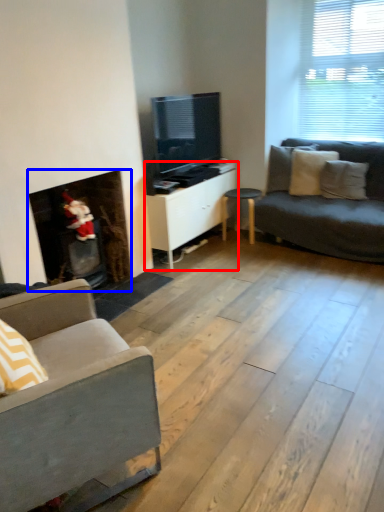
Question: Which object appears closest to the camera in this image, cabinetry (highlighted by a red box) or fireplace (highlighted by a blue box)?

Choices:
 (A) cabinetry
 (B) fireplace

Answer: (B)